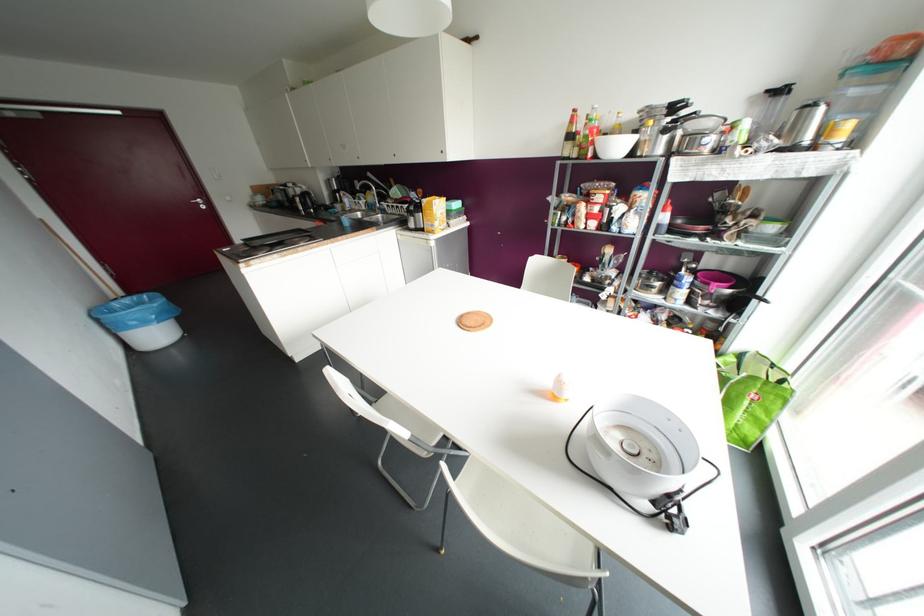
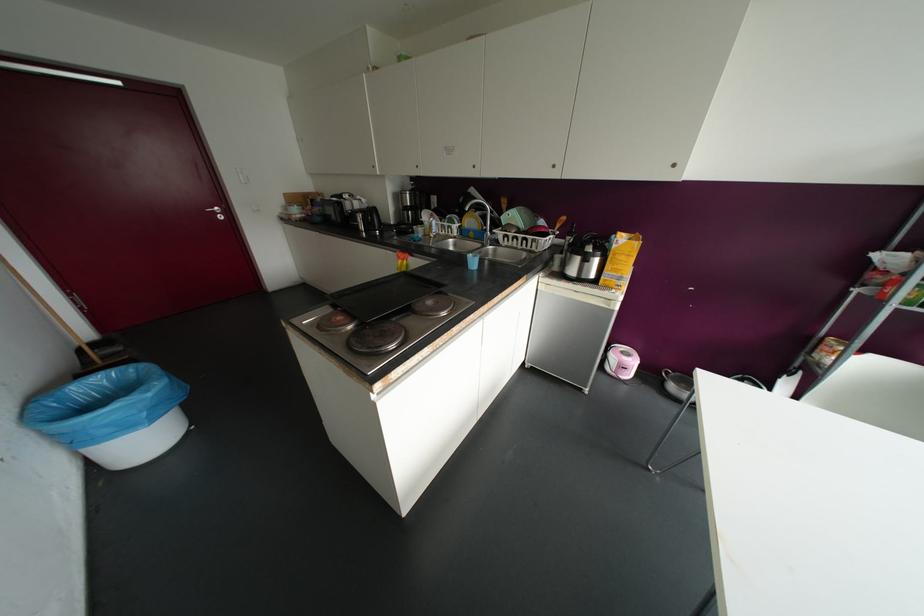
Where in the second image is the point corresponding to point 198,204 from the first image?

(214, 213)